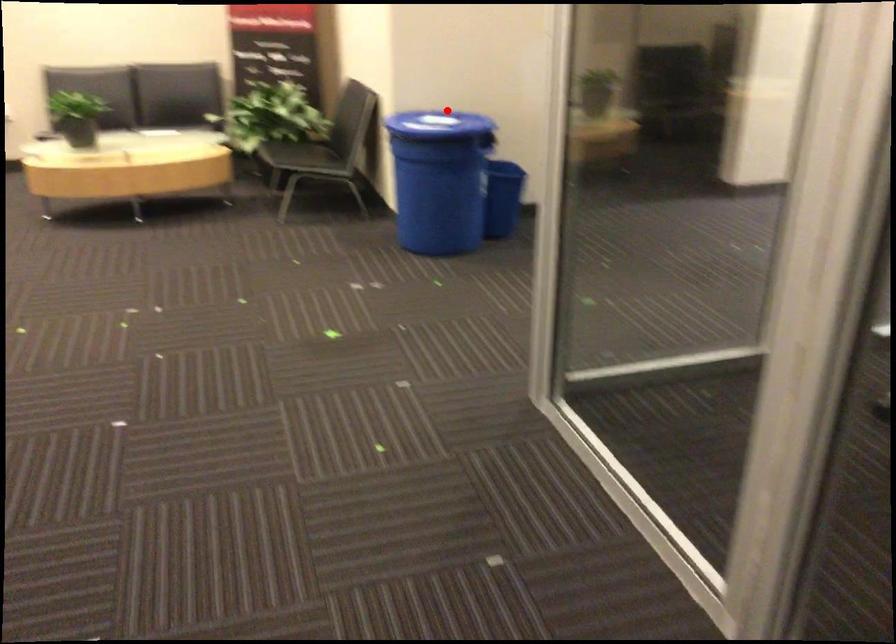
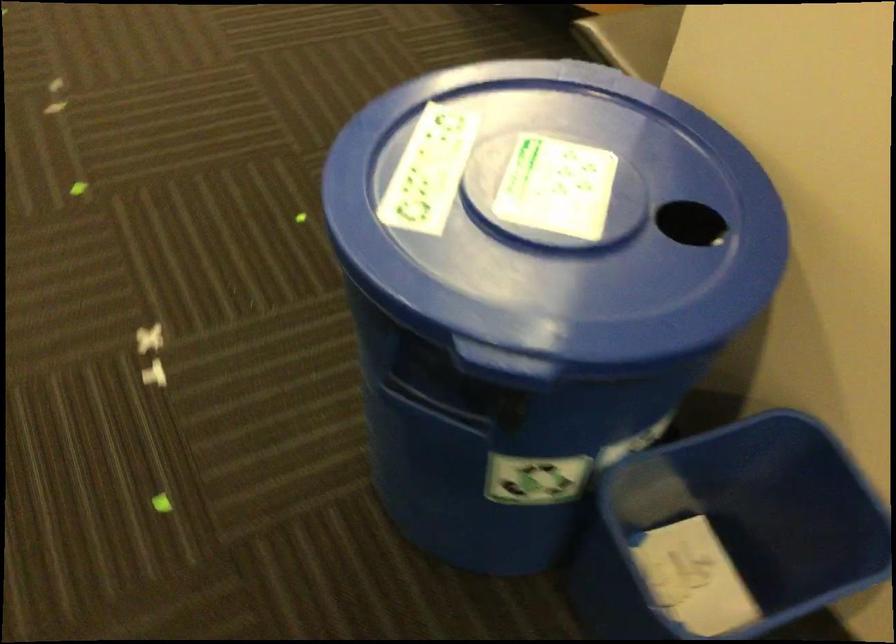
In the second image, find the point that corresponds to the highlighted location in the first image.

(561, 220)